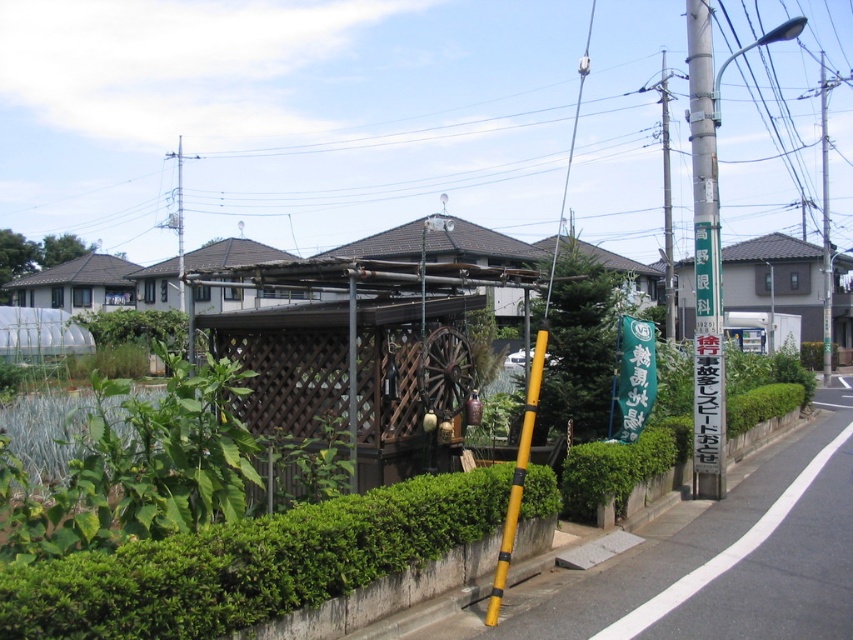
Who is higher up, green leafy hedge at left or metallic gray pole at center-right?

Positioned higher is metallic gray pole at center-right.

Does green leafy hedge at left have a lesser height compared to metallic gray pole at center-right?

Yes.

Between point (151, 332) and point (657, 83), which one is positioned in front?

Point (151, 332)

You are a GUI agent. You are given a task and a screenshot of the screen. Output one action in this format:
    pyautogui.click(x=<x>, y=<y>)
    Task: Click on the green leafy hedge at left
    
    Given the screenshot: What is the action you would take?
    pyautogui.click(x=136, y=326)

Can you confirm if green leafy hedge at lower left is thinner than green leafy hedge at lower center?

No, green leafy hedge at lower left is not thinner than green leafy hedge at lower center.

Is green leafy hedge at lower left smaller than green leafy hedge at lower center?

Incorrect, green leafy hedge at lower left is not smaller in size than green leafy hedge at lower center.

Does point (537, 474) lie behind point (570, 513)?

No, (537, 474) is in front of (570, 513).

What are the coordinates of `green leafy hedge at lower left` in the screenshot? It's located at (248, 563).

What do you see at coordinates (136, 326) in the screenshot? I see `green leafy hedge at left` at bounding box center [136, 326].

Based on the photo, is green leafy hedge at left to the right of smooth gray pole at right from the viewer's perspective?

Incorrect, green leafy hedge at left is not on the right side of smooth gray pole at right.

Locate an element on the screen. The image size is (853, 640). green leafy hedge at left is located at coordinates (136, 326).

Locate an element on the screen. The height and width of the screenshot is (640, 853). green leafy hedge at left is located at coordinates (136, 326).